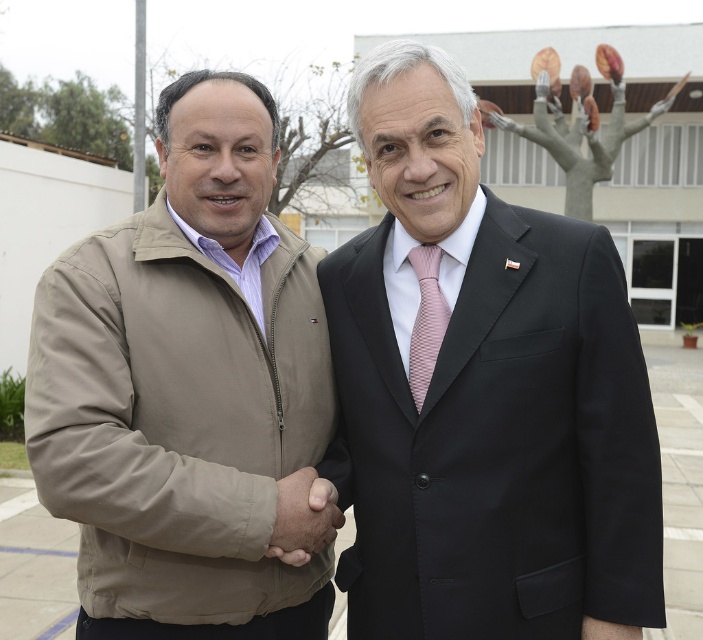
Question: Is black suit at center wider than pink woven tie at center?

Choices:
 (A) yes
 (B) no

Answer: (A)

Question: Can you confirm if tan softshell jacket at left is thinner than brown leather hand at center?

Choices:
 (A) yes
 (B) no

Answer: (B)

Question: Is tan softshell jacket at left to the right of brown leather hand at center from the viewer's perspective?

Choices:
 (A) yes
 (B) no

Answer: (B)

Question: Among these objects, which one is nearest to the camera?

Choices:
 (A) tan softshell jacket at left
 (B) black suit at center
 (C) pink woven tie at center

Answer: (A)

Question: Which of the following is the farthest from the observer?

Choices:
 (A) brown leather hand at center
 (B) pink woven tie at center

Answer: (B)

Question: Considering the real-world distances, which object is closest to the brown leather hand at center?

Choices:
 (A) black suit at center
 (B) tan softshell jacket at left
 (C) pink woven tie at center

Answer: (B)